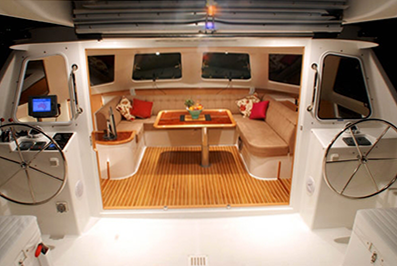
Locate an element on the screen. windows is located at coordinates (282, 70), (227, 67), (161, 67), (107, 68), (39, 80), (339, 85).